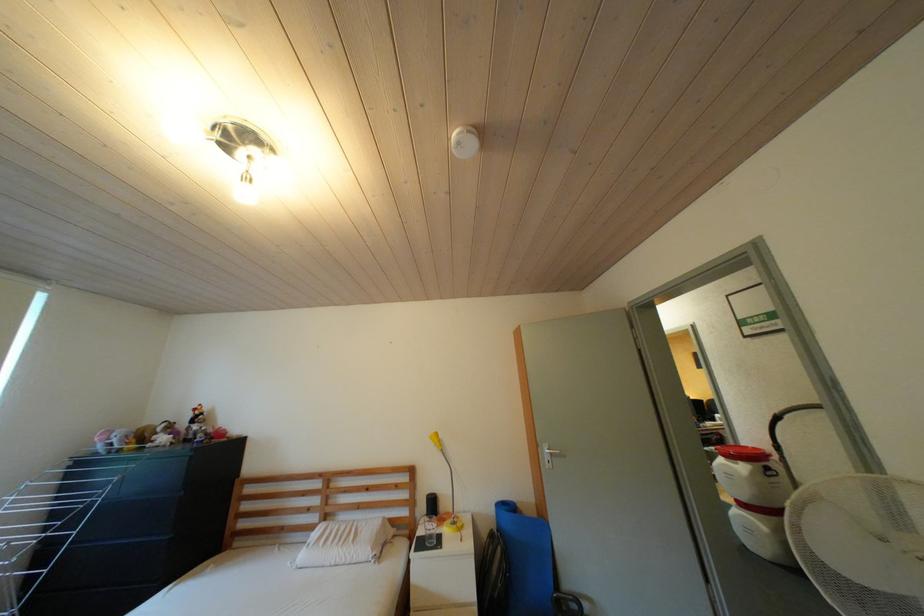
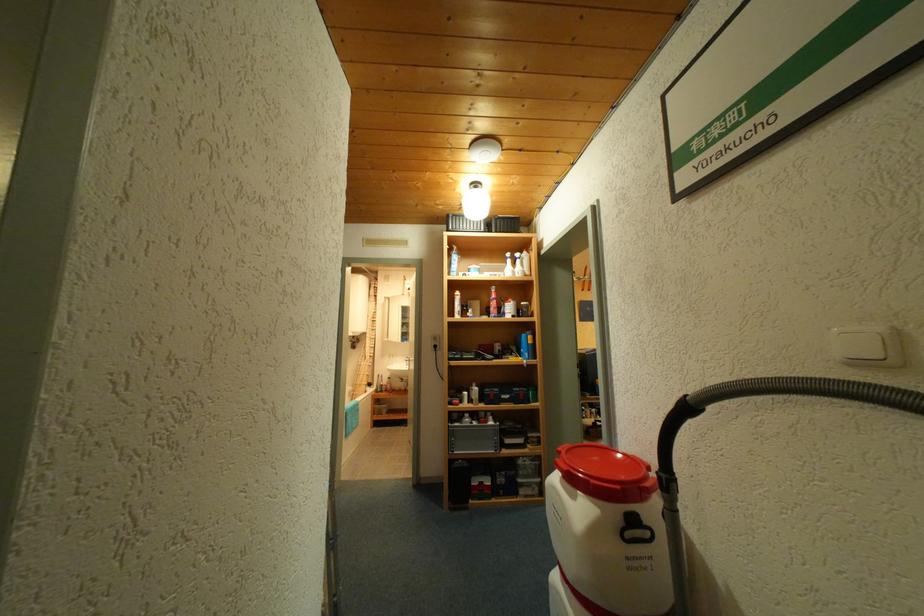
What movement of the cameraman would produce the second image?

The movement direction of the cameraman is right, forward.